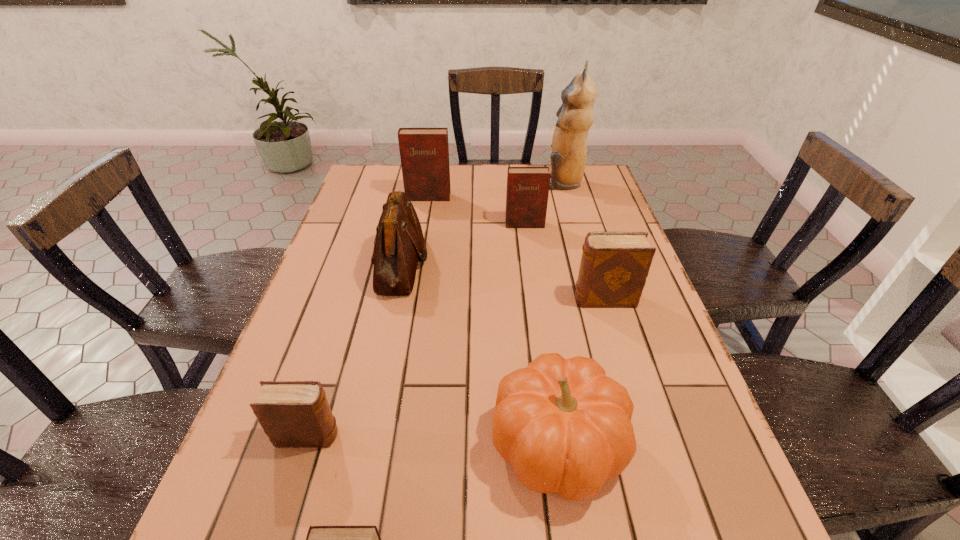
Locate an element on the screen. The height and width of the screenshot is (540, 960). vacant region at the far edge of the desktop is located at coordinates (503, 176).

The image size is (960, 540). In order to click on free space at the left edge in this screenshot , I will do `click(369, 281)`.

In the image, there is a desktop. Where is `vacant region at the right edge`? vacant region at the right edge is located at coordinates (720, 492).

Locate an element on the screen. vacant region between the cat and the shoulder bag is located at coordinates (482, 223).

Identify the location of vacant area that lies between the tallest object and the leftmost diary. (436, 309).

Identify the location of vacant area that lies between the second smallest reddish-brown diary and the farther brown diary. The width and height of the screenshot is (960, 540). (564, 262).

Locate an element on the screen. This screenshot has width=960, height=540. unoccupied position between the right brown diary and the left brown diary is located at coordinates [456, 368].

Where is `free space between the sixth nearest object and the shoulder bag`? The width and height of the screenshot is (960, 540). free space between the sixth nearest object and the shoulder bag is located at coordinates (463, 244).

Identify the location of vacant region between the nearer brown diary and the second nearest reddish-brown diary. (417, 330).

This screenshot has height=540, width=960. Find the location of `free space between the third nearest diary and the smaller brown diary`. free space between the third nearest diary and the smaller brown diary is located at coordinates (456, 368).